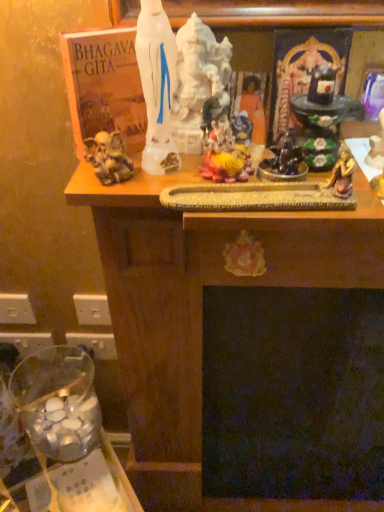
Question: From a real-world perspective, is white glossy statue at upper center on matte orange statue at center?

Choices:
 (A) no
 (B) yes

Answer: (B)

Question: Is matte orange statue at center completely or partially inside white glossy statue at upper center?

Choices:
 (A) yes
 (B) no

Answer: (B)

Question: Does white glossy statue at upper center have a larger size compared to matte orange statue at center?

Choices:
 (A) no
 (B) yes

Answer: (B)

Question: Does white glossy statue at upper center have a lesser height compared to matte orange statue at center?

Choices:
 (A) no
 (B) yes

Answer: (A)

Question: Is white glossy statue at upper center at the left side of matte orange statue at center?

Choices:
 (A) no
 (B) yes

Answer: (B)

Question: Considering their positions, is matte orange statue at center located in front of or behind white glossy statue at upper center?

Choices:
 (A) front
 (B) behind

Answer: (B)

Question: From a real-world perspective, is matte orange statue at center positioned above or below white glossy statue at upper center?

Choices:
 (A) above
 (B) below

Answer: (B)

Question: Based on their sizes in the image, would you say matte orange statue at center is bigger or smaller than white glossy statue at upper center?

Choices:
 (A) big
 (B) small

Answer: (B)

Question: Is point (258, 84) closer or farther from the camera than point (145, 10)?

Choices:
 (A) closer
 (B) farther

Answer: (B)

Question: In the image, is white glossy statue at upper center positioned in front of or behind clear glass jar at lower left?

Choices:
 (A) front
 (B) behind

Answer: (A)

Question: Is white glossy statue at upper center inside or outside of clear glass jar at lower left?

Choices:
 (A) outside
 (B) inside

Answer: (A)

Question: Is white glossy statue at upper center bigger or smaller than clear glass jar at lower left?

Choices:
 (A) small
 (B) big

Answer: (A)

Question: Is point (152, 98) positioned closer to the camera than point (14, 404)?

Choices:
 (A) closer
 (B) farther

Answer: (A)

Question: From the image's perspective, is white glossy statue at upper center positioned above or below matte orange statue at center?

Choices:
 (A) above
 (B) below

Answer: (A)

Question: From their relative heights in the image, would you say white glossy statue at upper center is taller or shorter than matte orange statue at center?

Choices:
 (A) short
 (B) tall

Answer: (B)